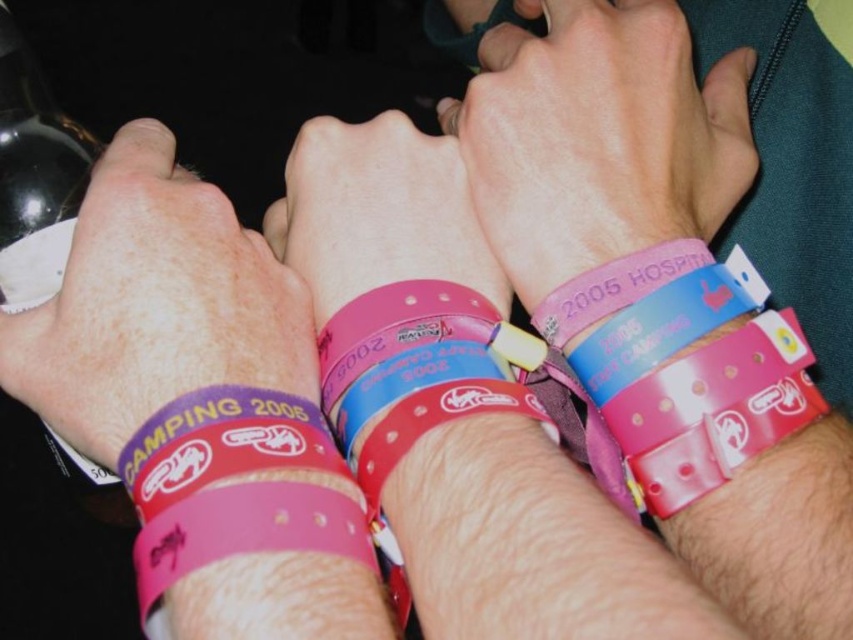
You are a jeweler examining two pink rubber wristbands on a customer. The customer wants to know which one is larger. The pink rubber wristband at center and the pink rubber wristband at lower center are both on their wrist. Can you tell them which one is bigger?

The pink rubber wristband at center is bigger than the pink rubber wristband at lower center.

You are a photographer taking a close up of four wrists with colorful wristbands. You need to focus on the purple matte wristband at center. What are the coordinates where you should aim your camera?

The purple matte wristband at center is located at coordinates point (154, 304).

In the scene shown: You are a photographer setting up a shoot. You need to ensure that the purple matte wristband at center and the black matte bottle at upper left are both visible in the frame. Given their sizes, which object should you focus on first to ensure proper framing?

The purple matte wristband at center is larger than the black matte bottle at upper left, so you should focus on framing the purple matte wristband at center first to ensure it fits well in the frame before adjusting for the smaller black matte bottle at upper left.